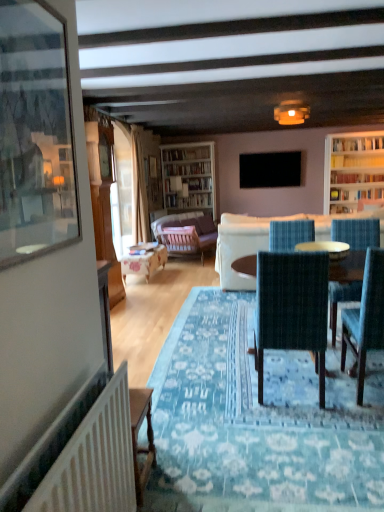
Image resolution: width=384 pixels, height=512 pixels. I want to click on vacant point to the right of wooden cabinet at left, so click(x=142, y=302).